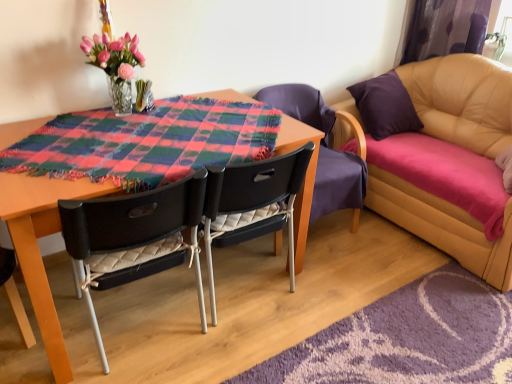
Question: Considering the positions of point (303, 120) and point (245, 231), is point (303, 120) closer or farther from the camera than point (245, 231)?

Choices:
 (A) closer
 (B) farther

Answer: (B)

Question: In the image, is black quilted chair at center, marked as the 1th chair in a right-to-left arrangement, positioned in front of or behind black plastic chair at center, marked as the second chair in a left-to-right arrangement?

Choices:
 (A) front
 (B) behind

Answer: (B)

Question: Which object is the closest to the black quilted chair at center, the third chair from the left?

Choices:
 (A) black quilted fabric chair at center, the third chair positioned from the right
 (B) purple shaggy rug at lower right
 (C) leather couch at right
 (D) purple fabric curtain at upper right
 (E) plaid fabric at center

Answer: (E)

Question: Which object is positioned farthest from the black plastic chair at center, marked as the second chair in a left-to-right arrangement?

Choices:
 (A) purple shaggy rug at lower right
 (B) translucent glass vase at upper left
 (C) black quilted chair at center, marked as the 1th chair in a right-to-left arrangement
 (D) purple fabric curtain at upper right
 (E) black quilted fabric chair at center, acting as the first chair starting from the left

Answer: (D)